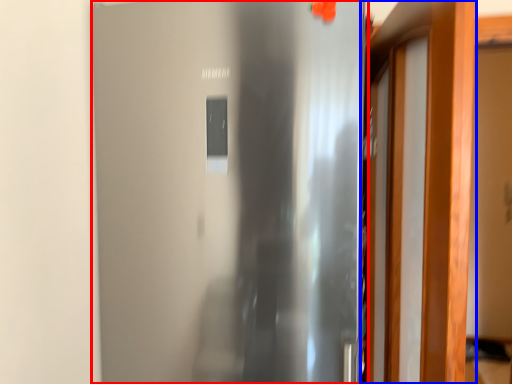
Question: Which object appears closest to the camera in this image, door (highlighted by a red box) or door (highlighted by a blue box)?

Choices:
 (A) door
 (B) door

Answer: (B)